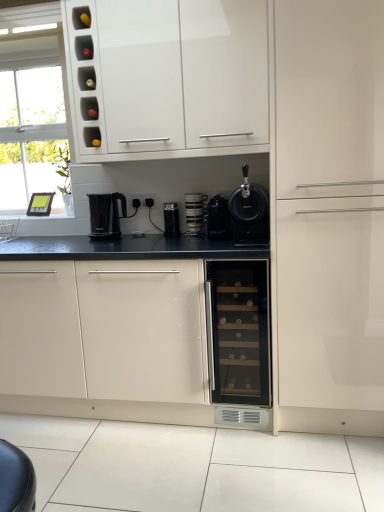
Question: Does matte glass wine cooler at center have a larger size compared to black plastic electric outlet at center?

Choices:
 (A) yes
 (B) no

Answer: (A)

Question: Is matte glass wine cooler at center completely or partially outside of black plastic electric outlet at center?

Choices:
 (A) yes
 (B) no

Answer: (A)

Question: Considering the relative positions of matte glass wine cooler at center and black plastic electric outlet at center in the image provided, is matte glass wine cooler at center to the right of black plastic electric outlet at center from the viewer's perspective?

Choices:
 (A) yes
 (B) no

Answer: (A)

Question: Considering the relative sizes of matte glass wine cooler at center and black plastic electric outlet at center in the image provided, is matte glass wine cooler at center wider than black plastic electric outlet at center?

Choices:
 (A) no
 (B) yes

Answer: (B)

Question: Is matte glass wine cooler at center thinner than black plastic electric outlet at center?

Choices:
 (A) no
 (B) yes

Answer: (A)

Question: Is black plastic electric outlet at center surrounded by matte glass wine cooler at center?

Choices:
 (A) no
 (B) yes

Answer: (A)

Question: Can you confirm if black matte coffee machine at center is taller than black plastic electric outlet at center?

Choices:
 (A) no
 (B) yes

Answer: (B)

Question: From the image's perspective, would you say black matte coffee machine at center is shown under black plastic electric outlet at center?

Choices:
 (A) no
 (B) yes

Answer: (B)

Question: Is black matte coffee machine at center oriented away from black plastic electric outlet at center?

Choices:
 (A) no
 (B) yes

Answer: (A)

Question: Could you tell me if black matte coffee machine at center is facing black plastic electric outlet at center?

Choices:
 (A) yes
 (B) no

Answer: (B)

Question: Are black matte coffee machine at center and black plastic electric outlet at center located far from each other?

Choices:
 (A) no
 (B) yes

Answer: (A)

Question: Can you confirm if black matte coffee machine at center is smaller than black plastic electric outlet at center?

Choices:
 (A) no
 (B) yes

Answer: (A)

Question: Is black plastic kettle at center, placed as the fourth kitchen appliance when sorted from right to left, aimed at glossy white wine cooler at center, the third cabinetry positioned from the right?

Choices:
 (A) yes
 (B) no

Answer: (B)